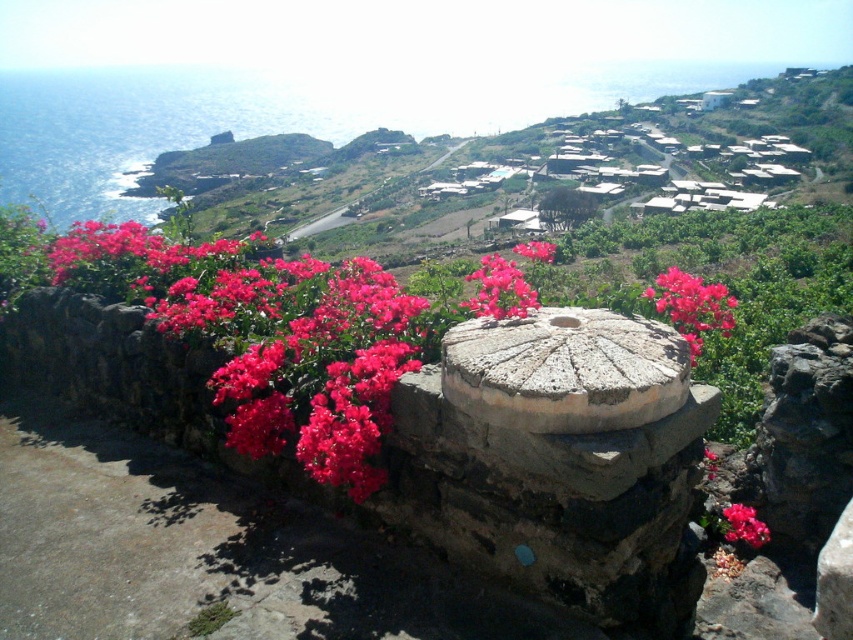
You are standing at the base of the stone wall in the coastal landscape and notice two pink matte flowers. One is labeled as the matte pink flower at center, and the other is the pink matte flower at center. Which flower is closer to you?

Both the matte pink flower at center and the pink matte flower at center are the same flower, so there is no distance between them.

You are an artist sketching the coastal landscape. You notice two pink flowers in the foreground. Which one, the matte pink flower at center or the pink matte flower at center, is positioned to the right?

The matte pink flower at center is positioned to the right of the pink matte flower at center.

You are an artist sketching the coastal landscape. You notice two groups of flowers in the scene. The first group is labeled as matte pink flowers at center, and the second is matte pink flower at center. Which group has a wider spread?

The matte pink flowers at center has a wider spread than the matte pink flower at center.